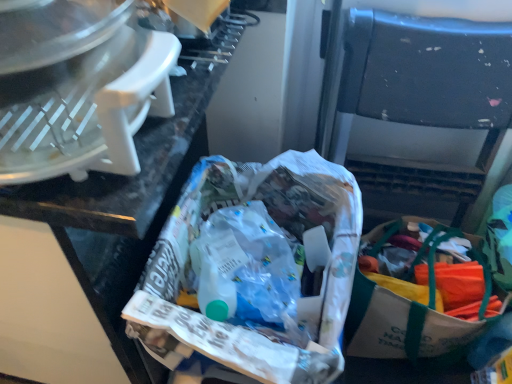
Question: Is white canvas bag with green straps at lower right to the right of white plastic food processor at upper left from the viewer's perspective?

Choices:
 (A) no
 (B) yes

Answer: (B)

Question: From a real-world perspective, is white canvas bag with green straps at lower right positioned over white plastic food processor at upper left based on gravity?

Choices:
 (A) yes
 (B) no

Answer: (B)

Question: Is white canvas bag with green straps at lower right taller than white plastic food processor at upper left?

Choices:
 (A) yes
 (B) no

Answer: (A)

Question: Is white canvas bag with green straps at lower right aimed at white plastic food processor at upper left?

Choices:
 (A) yes
 (B) no

Answer: (B)

Question: Is white canvas bag with green straps at lower right positioned beyond the bounds of white plastic food processor at upper left?

Choices:
 (A) yes
 (B) no

Answer: (A)

Question: Does white canvas bag with green straps at lower right have a larger size compared to white plastic food processor at upper left?

Choices:
 (A) no
 (B) yes

Answer: (B)

Question: Does white paper bag at center have a lesser height compared to black plastic folding chair at center?

Choices:
 (A) no
 (B) yes

Answer: (B)

Question: From a real-world perspective, is white paper bag at center physically below black plastic folding chair at center?

Choices:
 (A) no
 (B) yes

Answer: (A)

Question: Is white paper bag at center directly adjacent to black plastic folding chair at center?

Choices:
 (A) yes
 (B) no

Answer: (B)

Question: From the image's perspective, would you say white paper bag at center is positioned over black plastic folding chair at center?

Choices:
 (A) yes
 (B) no

Answer: (B)

Question: From the image's perspective, is white paper bag at center located beneath black plastic folding chair at center?

Choices:
 (A) no
 (B) yes

Answer: (B)

Question: Can you confirm if white paper bag at center is positioned to the right of black plastic folding chair at center?

Choices:
 (A) no
 (B) yes

Answer: (A)

Question: Are white plastic food processor at upper left and white paper bag at center located far from each other?

Choices:
 (A) no
 (B) yes

Answer: (A)